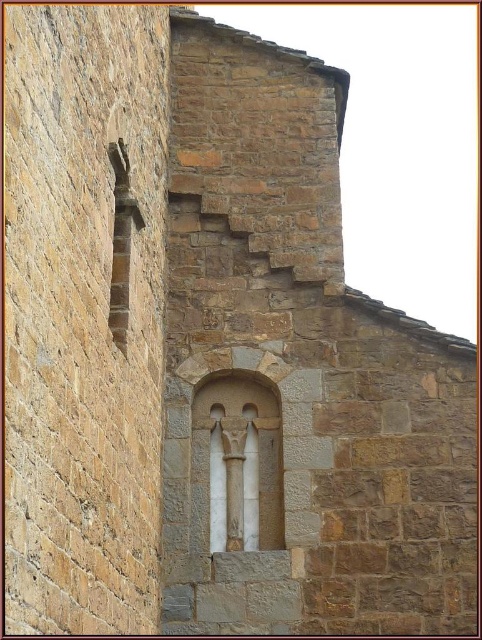
Between white marble window at center and white stone column at center, which one is positioned lower?

white stone column at center

Does point (231, 532) come farther from viewer compared to point (228, 481)?

That is False.

Does point (240, 486) lie in front of point (241, 468)?

Yes.

Where is `white marble window at center`? The height and width of the screenshot is (640, 482). white marble window at center is located at coordinates (237, 465).